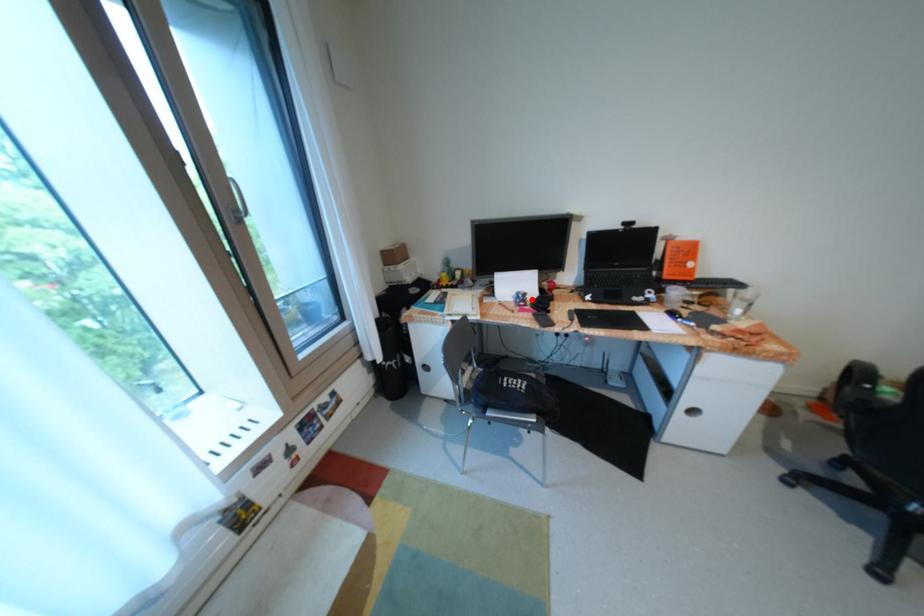
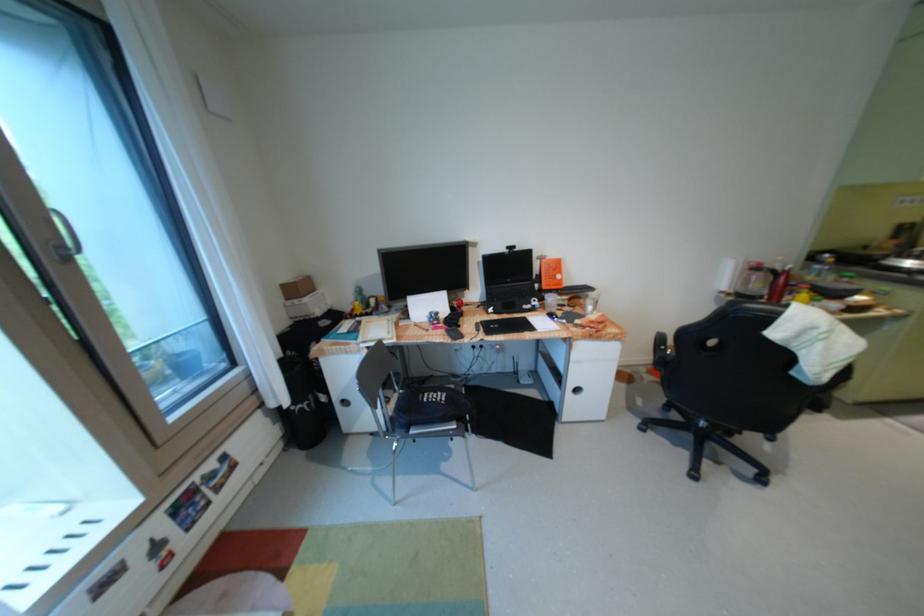
Where in the second image is the point corresponding to the highlighted location from the first image?

(444, 318)